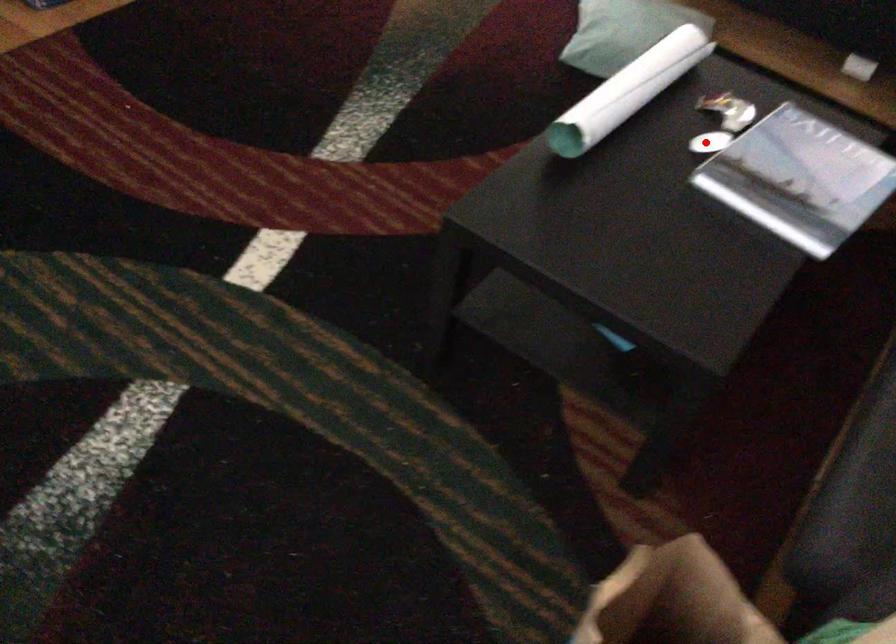
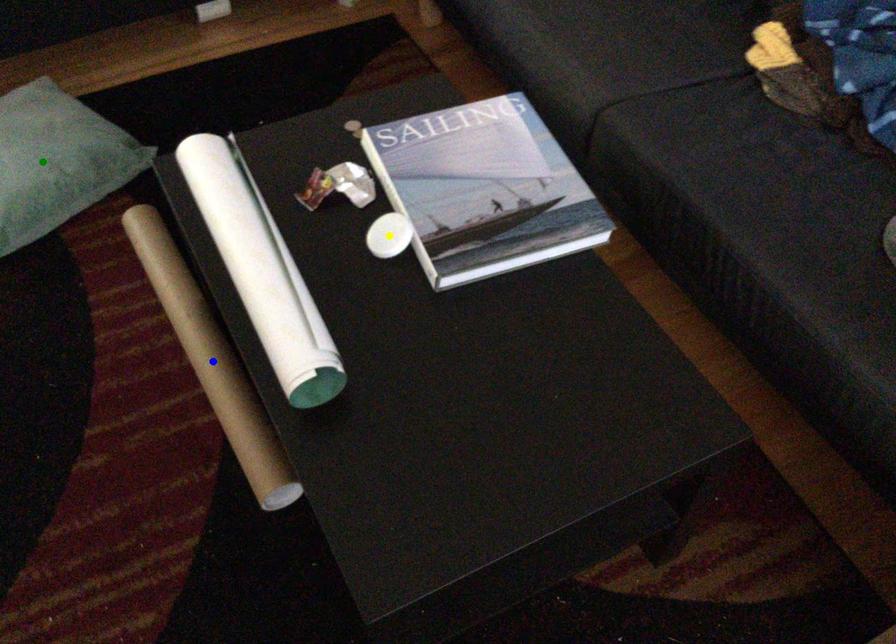
Question: I am providing you with two images of the same scene from different viewpoints. A red point is marked on the first image. You are given multiple points on the second image. Which mark in image 2 goes with the point in image 1?

Choices:
 (A) green point
 (B) blue point
 (C) yellow point

Answer: (C)